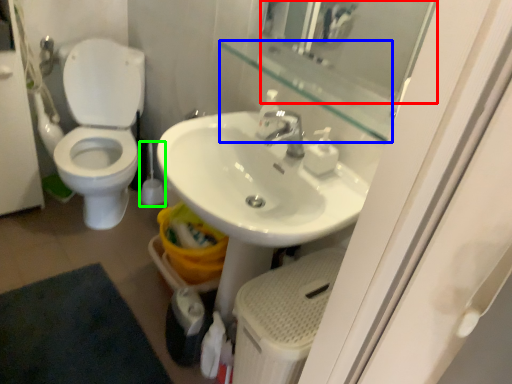
Question: Which object is positioned closest to mirror (highlighted by a red box)? Select from balustrade (highlighted by a blue box) and brush (highlighted by a green box).

Choices:
 (A) balustrade
 (B) brush

Answer: (A)